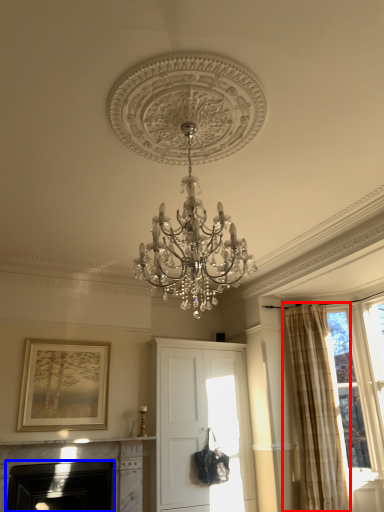
Question: Which object is further to the camera taking this photo, curtain (highlighted by a red box) or fireplace (highlighted by a blue box)?

Choices:
 (A) curtain
 (B) fireplace

Answer: (A)